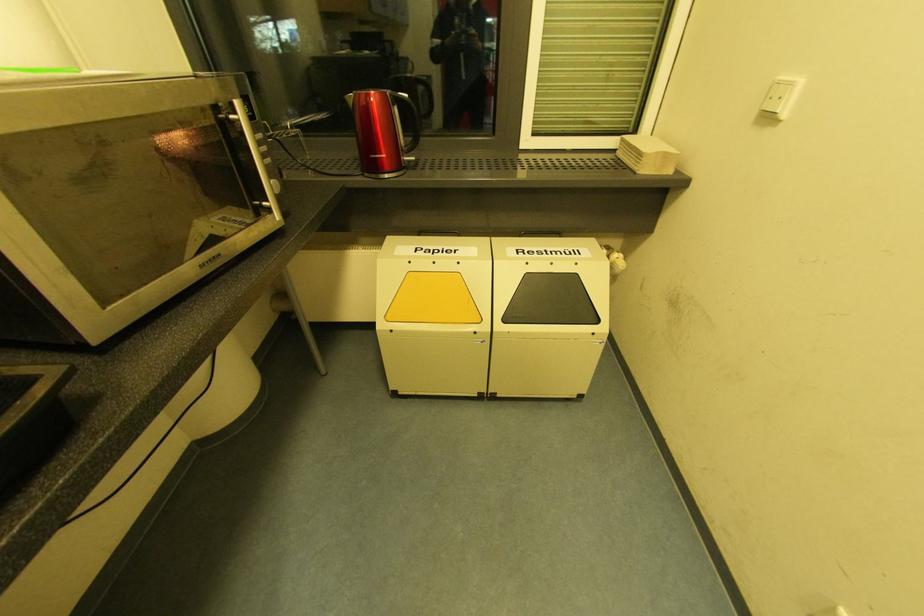
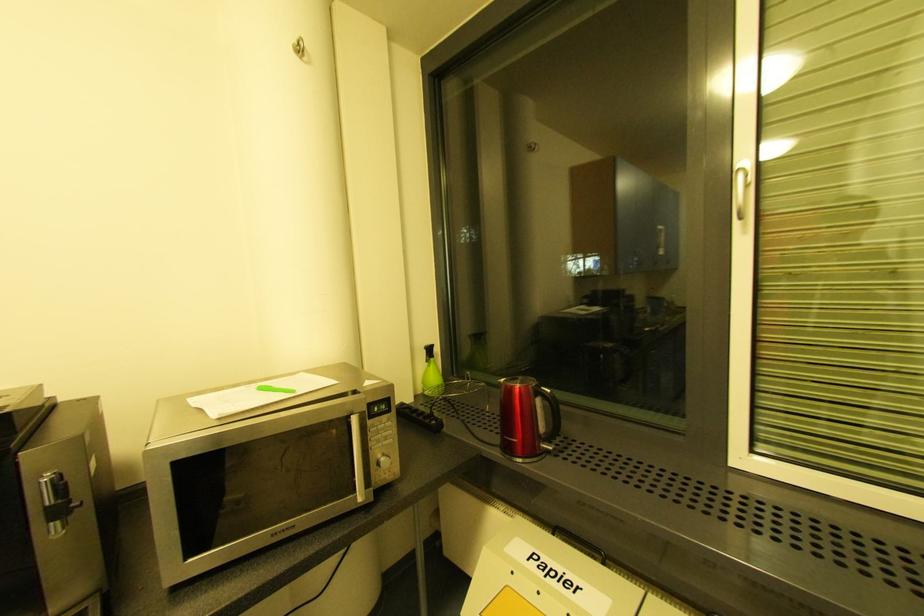
First-person continuous shooting, in which direction is the camera rotating?

The rotation direction of the camera is left-up.